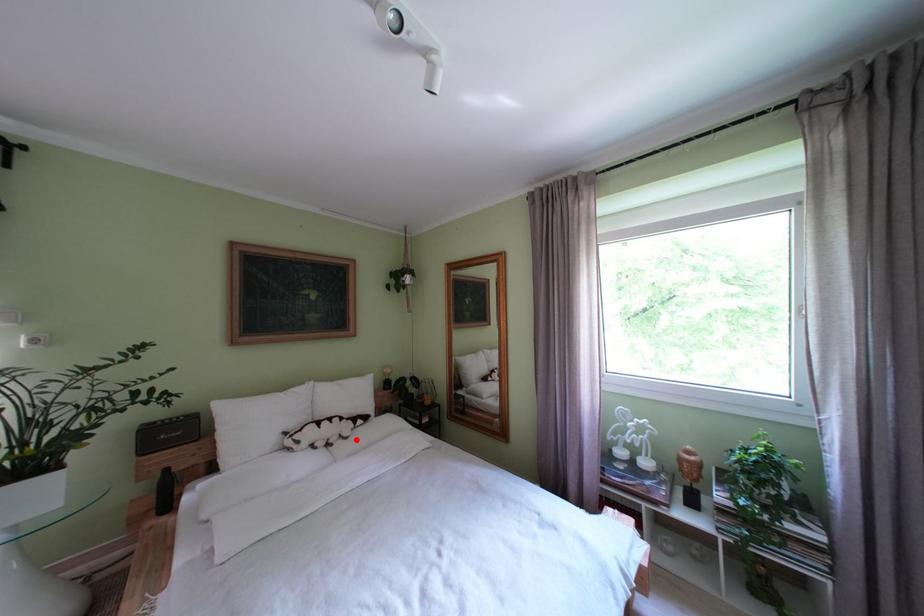
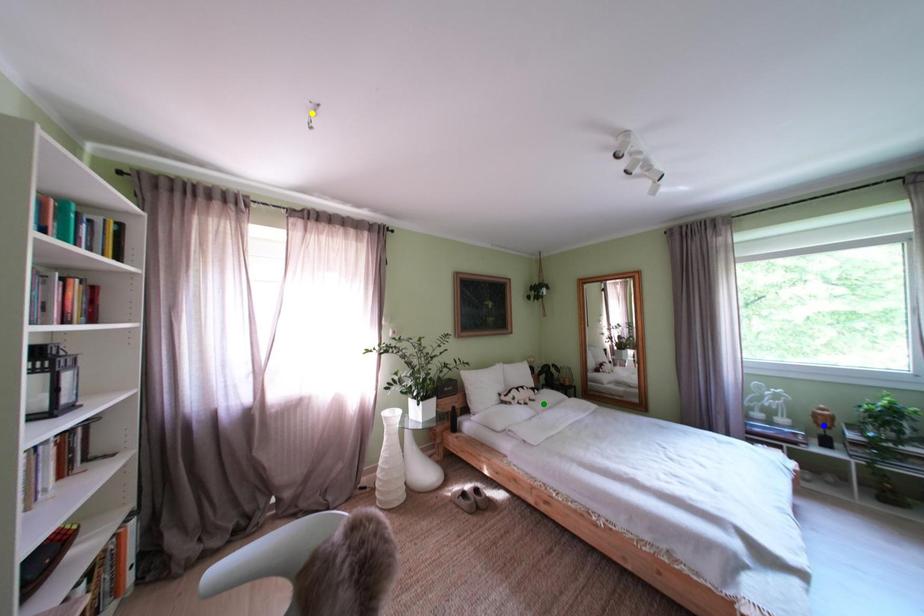
Question: I am providing you with two images of the same scene from different viewpoints. A red point is marked on the first image. You are given multiple points on the second image. Which point in image 2 represents the same 3d spot as the red point in image 1?

Choices:
 (A) green point
 (B) yellow point
 (C) blue point

Answer: (A)